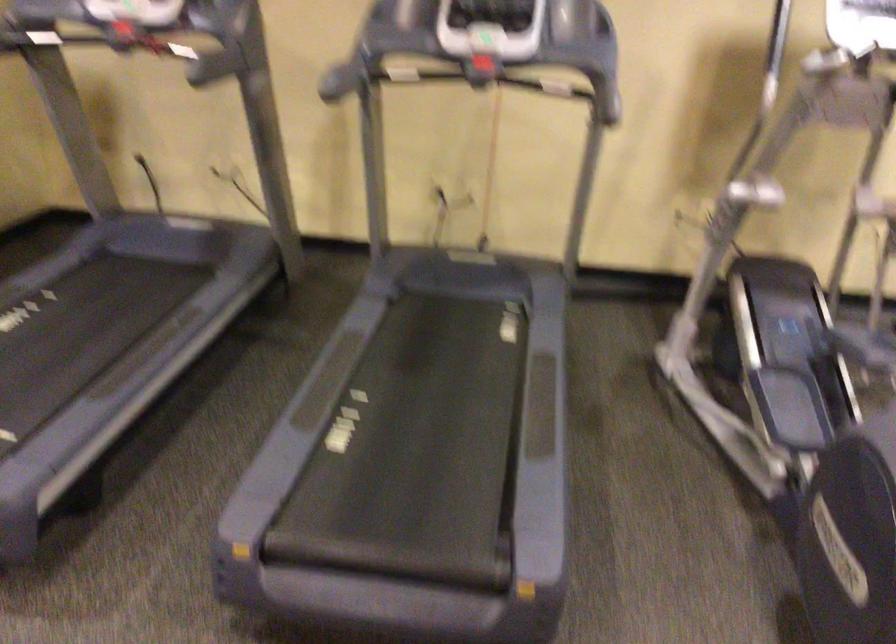
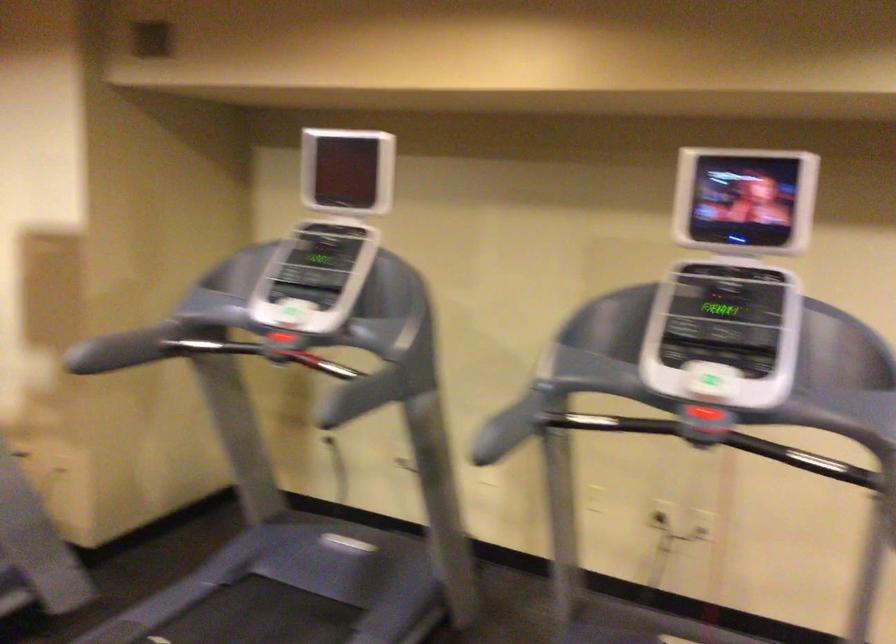
Question: In a continuous first-person perspective shot, in which direction is the camera moving?

Choices:
 (A) Left
 (B) Right
 (C) Forward
 (D) Backward

Answer: (C)